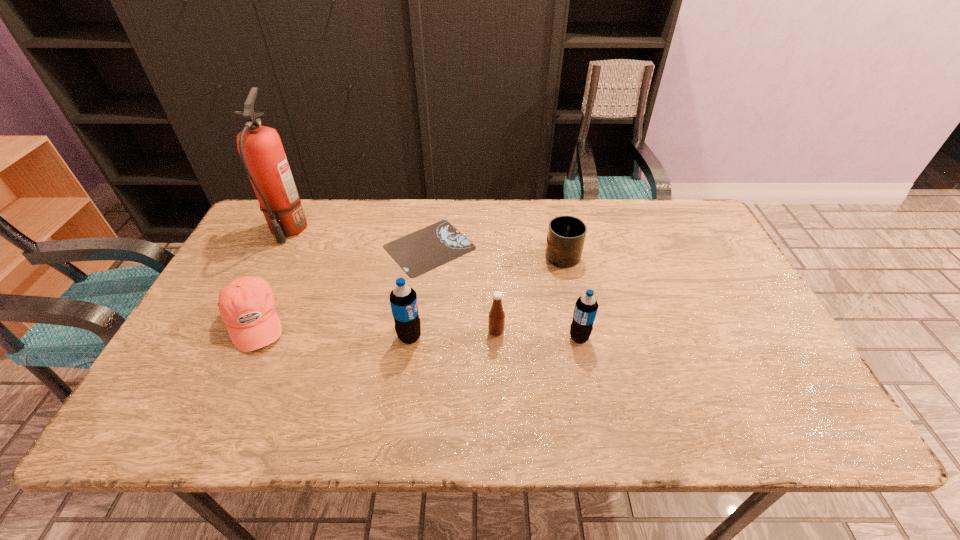
Please point a free position for a soda bottle on the right. Please provide its 2D coordinates. Your answer should be formatted as a tuple, i.e. [(x, y)], where the tuple contains the x and y coordinates of a point satisfying the conditions above.

[(749, 338)]